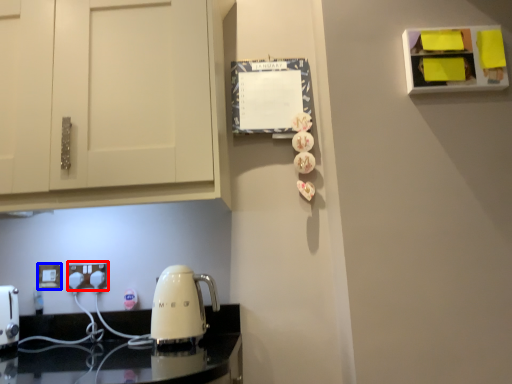
Question: Among these objects, which one is farthest to the camera, electric outlet (highlighted by a red box) or electric outlet (highlighted by a blue box)?

Choices:
 (A) electric outlet
 (B) electric outlet

Answer: (B)